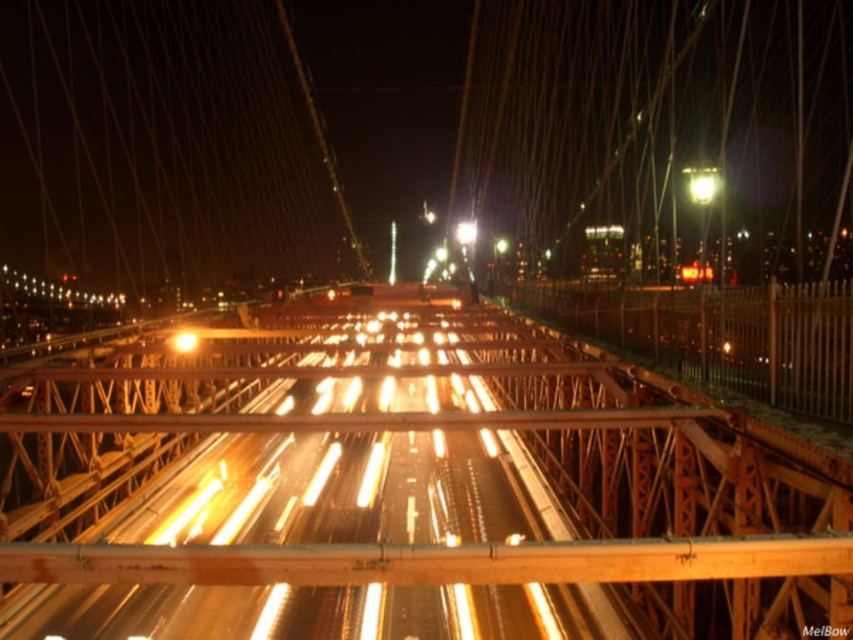
Is point (187, 339) more distant than point (463, 224)?

That is False.

Consider the image. Is yellow metallic light at center below bright metallic streetlight at center?

Yes, yellow metallic light at center is below bright metallic streetlight at center.

Who is more distant from viewer, (173, 337) or (474, 237)?

Point (474, 237)

You are a GUI agent. You are given a task and a screenshot of the screen. Output one action in this format:
    pyautogui.click(x=<x>, y=<y>)
    Task: Click on the yellow metallic light at center
    The height and width of the screenshot is (640, 853).
    Given the screenshot: What is the action you would take?
    pyautogui.click(x=184, y=340)